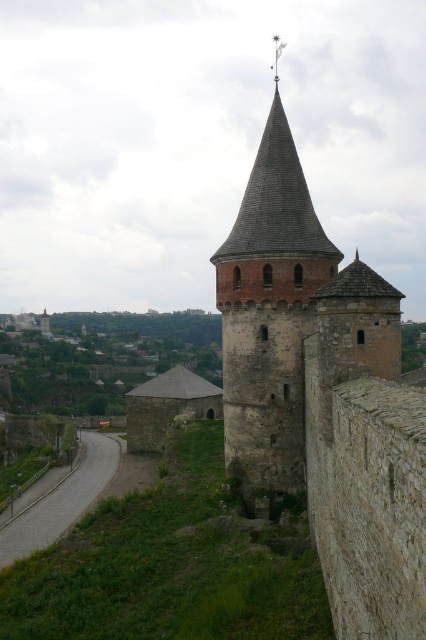
You are a medieval knight standing on the green grassy hillside at upper center. You want to reach the top of the rustic stone tower at center to look out for approaching enemies. Which direction should you move to ascend towards the tower?

The rustic stone tower at center is above the green grassy hillside at upper center, so you should move upward towards the tower to reach its top.

You are a medieval architect assessing the fortress layout. You need to determine where to place a new flagpole. The flagpole must be placed on the green grassy hillside at upper center. However, the base of the flagpole must not be closer than 10 meters to any structure. Given that the rustic stone tower at center is already present, is the proposed location feasible?

The rustic stone tower at center is positioned on the right side of green grassy hillside at upper center. Since the tower is on the hillside, placing the flagpole base 10 meters away from it would require careful placement to ensure sufficient space. However, the description does not provide the exact dimensions or distance between the tower and the hillside edge, making it impossible to confirm feasibility without additional measurements.